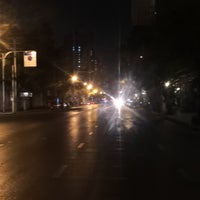
This screenshot has width=200, height=200. I want to click on lights, so click(72, 79), click(90, 86), click(95, 91).